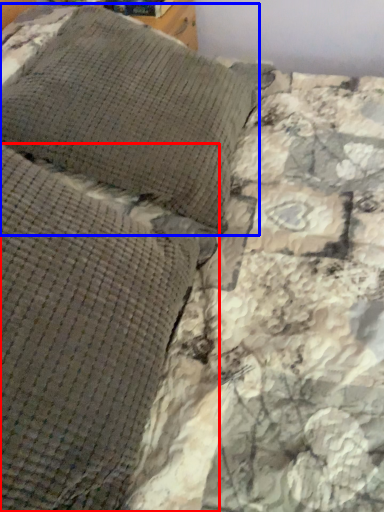
Question: Which object is further to the camera taking this photo, pillow (highlighted by a red box) or pillow (highlighted by a blue box)?

Choices:
 (A) pillow
 (B) pillow

Answer: (B)